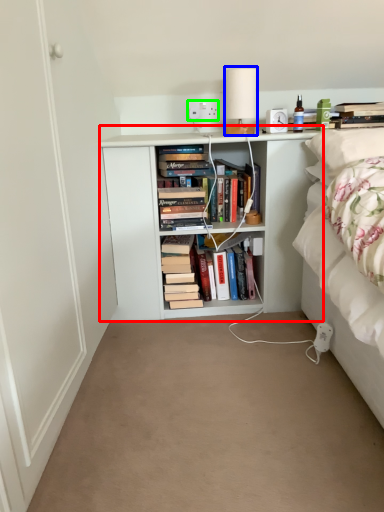
Question: Which is nearer to the shelf (highlighted by a red box)? table lamp (highlighted by a blue box) or electric outlet (highlighted by a green box).

Choices:
 (A) table lamp
 (B) electric outlet

Answer: (A)